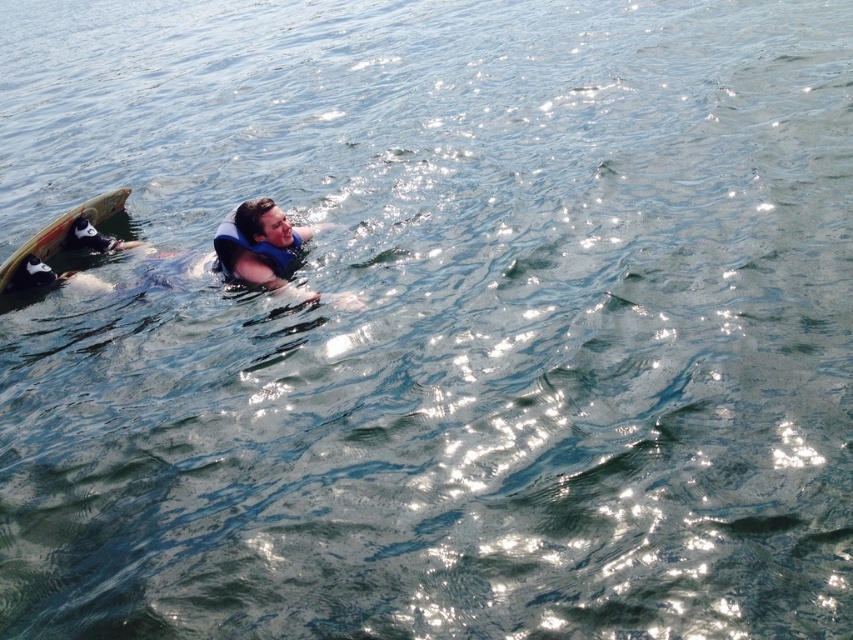
Describe the element at coordinates (253, 240) in the screenshot. The image size is (853, 640). I see `blue fabric life jacket at center` at that location.

Between blue fabric life jacket at center and wooden surfboard at left, which one is positioned lower?

blue fabric life jacket at center is lower down.

The image size is (853, 640). Find the location of `blue fabric life jacket at center`. blue fabric life jacket at center is located at coordinates coord(253,240).

The image size is (853, 640). Identify the location of blue fabric life jacket at center. (253, 240).

Which of these two, blue life vest at center or blue fabric life jacket at center, stands taller?

blue life vest at center

Is the position of blue life vest at center more distant than that of blue fabric life jacket at center?

Yes, blue life vest at center is further from the viewer.

Is point (61, 221) farther from viewer compared to point (260, 230)?

Yes, it is behind point (260, 230).

In order to click on blue life vest at center in this screenshot , I will do `click(267, 250)`.

Based on the photo, is blue life vest at center shorter than wooden surfboard at left?

Indeed, blue life vest at center has a lesser height compared to wooden surfboard at left.

This screenshot has height=640, width=853. Describe the element at coordinates (267, 250) in the screenshot. I see `blue life vest at center` at that location.

Identify the location of blue life vest at center. (267, 250).